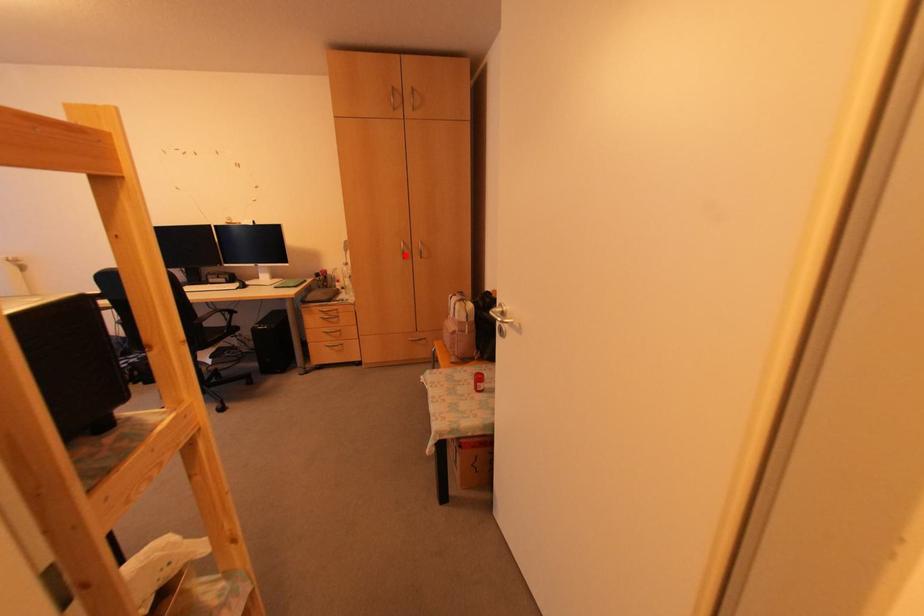
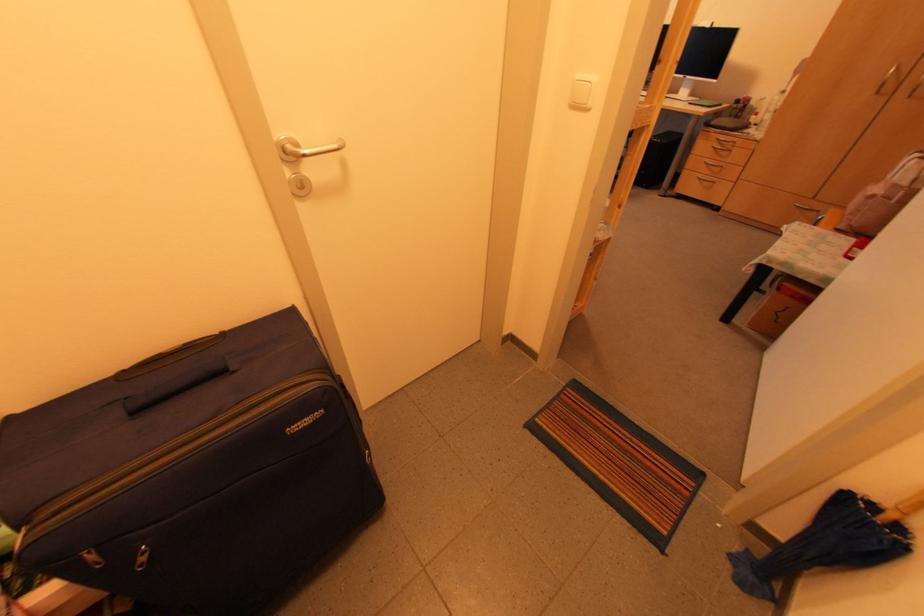
Question: I am providing you with two images of the same scene from different viewpoints. A red point is shown in image1. For the corresponding object point in image2, is it positioned nearer or farther from the camera?

Choices:
 (A) Nearer
 (B) Farther

Answer: (B)